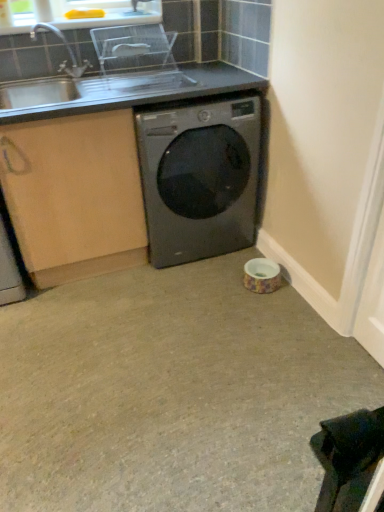
Locate an element on the screen. Image resolution: width=384 pixels, height=512 pixels. satin black washing machine at center is located at coordinates tap(199, 178).

This screenshot has width=384, height=512. Describe the element at coordinates (90, 68) in the screenshot. I see `silver metallic sink at upper left` at that location.

Locate an element on the screen. beige carpet at center is located at coordinates (171, 393).

Is satin black washing machine at center not near beige carpet at center?

That's not correct — satin black washing machine at center is a little close to beige carpet at center.

Is satin black washing machine at center to the left or to the right of beige carpet at center in the image?

From the image, it's evident that satin black washing machine at center is to the right of beige carpet at center.

Which of these two, satin black washing machine at center or beige carpet at center, stands taller?

satin black washing machine at center is taller.

From a real-world perspective, is satin black washing machine at center located higher than beige carpet at center?

Yes, from a real-world perspective, satin black washing machine at center is over beige carpet at center

Is clear plastic dish rack at upper center turned away from silver metallic sink at upper left?

Absolutely, clear plastic dish rack at upper center is directed away from silver metallic sink at upper left.

What's the angular difference between clear plastic dish rack at upper center and silver metallic sink at upper left's facing directions?

clear plastic dish rack at upper center and silver metallic sink at upper left are facing 0.000225 degrees away from each other.

Is point (162, 32) positioned in front of point (8, 94)?

No, it is behind (8, 94).

Does clear plastic dish rack at upper center come in front of silver metallic sink at upper left?

No, clear plastic dish rack at upper center is further to the viewer.

Between point (278, 409) and point (63, 92), which one is positioned behind?

The point (63, 92) is farther from the camera.

Does beige carpet at center have a larger size compared to silver metallic sink at upper left?

No, beige carpet at center is not bigger than silver metallic sink at upper left.

Is beige carpet at center with silver metallic sink at upper left?

No, beige carpet at center is not making contact with silver metallic sink at upper left.

Can you see satin black washing machine at center touching silver metallic sink at upper left?

No, satin black washing machine at center is not touching silver metallic sink at upper left.

You are a GUI agent. You are given a task and a screenshot of the screen. Output one action in this format:
    pyautogui.click(x=<x>, y=<y>)
    Task: Click on the washing machine that appears on the right of silver metallic sink at upper left
    The width and height of the screenshot is (384, 512).
    Given the screenshot: What is the action you would take?
    pyautogui.click(x=199, y=178)

Which is behind, point (175, 108) or point (52, 83)?

The point (52, 83) is farther.

Considering the sizes of satin black washing machine at center and silver metallic sink at upper left in the image, is satin black washing machine at center taller or shorter than silver metallic sink at upper left?

Clearly, satin black washing machine at center is taller compared to silver metallic sink at upper left.

Considering the relative sizes of silver metallic sink at upper left and clear plastic dish rack at upper center in the image provided, is silver metallic sink at upper left shorter than clear plastic dish rack at upper center?

Incorrect, the height of silver metallic sink at upper left does not fall short of that of clear plastic dish rack at upper center.

Do you think silver metallic sink at upper left is within clear plastic dish rack at upper center, or outside of it?

silver metallic sink at upper left is outside clear plastic dish rack at upper center.

From the image's perspective, which one is positioned lower, silver metallic sink at upper left or clear plastic dish rack at upper center?

From the image's view, silver metallic sink at upper left is below.

Is the position of silver metallic sink at upper left less distant than that of clear plastic dish rack at upper center?

Yes, silver metallic sink at upper left is in front of clear plastic dish rack at upper center.

Does silver metallic sink at upper left touch satin black washing machine at center?

No, silver metallic sink at upper left is not next to satin black washing machine at center.

Between point (122, 61) and point (241, 194), which one is positioned behind?

The point (122, 61) is farther from the camera.

How different are the orientations of silver metallic sink at upper left and satin black washing machine at center in degrees?

There is a 0.000334-degree angle between the facing directions of silver metallic sink at upper left and satin black washing machine at center.

Locate an element on the screen. The height and width of the screenshot is (512, 384). washing machine lying behind the silver metallic sink at upper left is located at coordinates pyautogui.click(x=199, y=178).

Is clear plastic dish rack at upper center to the left or to the right of satin black washing machine at center in the image?

clear plastic dish rack at upper center is to the left of satin black washing machine at center.

The height and width of the screenshot is (512, 384). Identify the location of appliance on the left side of satin black washing machine at center. [x=138, y=58].

Looking at this image, how many degrees apart are the facing directions of clear plastic dish rack at upper center and satin black washing machine at center?

The facing directions of clear plastic dish rack at upper center and satin black washing machine at center are 0.000124 degrees apart.

Would you say clear plastic dish rack at upper center is a long distance from satin black washing machine at center?

They are positioned close to each other.

Locate an element on the screen. washing machine behind the beige carpet at center is located at coordinates (199, 178).

Where is `appliance above the silver metallic sink at upper left (from the image's perspective)`? appliance above the silver metallic sink at upper left (from the image's perspective) is located at coordinates coord(138,58).

When comparing their distances from clear plastic dish rack at upper center, does satin black washing machine at center or beige carpet at center seem further?

Among the two, beige carpet at center is located further to clear plastic dish rack at upper center.

From the image, which object appears to be farther from beige carpet at center, clear plastic dish rack at upper center or satin black washing machine at center?

clear plastic dish rack at upper center.

Estimate the real-world distances between objects in this image. Which object is closer to beige carpet at center, clear plastic dish rack at upper center or silver metallic sink at upper left?

The object closer to beige carpet at center is silver metallic sink at upper left.

Estimate the real-world distances between objects in this image. Which object is further from silver metallic sink at upper left, satin black washing machine at center or beige carpet at center?

The object further to silver metallic sink at upper left is beige carpet at center.

When comparing their distances from clear plastic dish rack at upper center, does beige carpet at center or satin black washing machine at center seem further?

The object further to clear plastic dish rack at upper center is beige carpet at center.

When comparing their distances from clear plastic dish rack at upper center, does silver metallic sink at upper left or beige carpet at center seem further?

The object further to clear plastic dish rack at upper center is beige carpet at center.

From the image, which object appears to be nearer to silver metallic sink at upper left, clear plastic dish rack at upper center or beige carpet at center?

clear plastic dish rack at upper center is positioned closer to the anchor silver metallic sink at upper left.

Consider the image. Based on their spatial positions, is beige carpet at center or clear plastic dish rack at upper center closer to silver metallic sink at upper left?

Based on the image, clear plastic dish rack at upper center appears to be nearer to silver metallic sink at upper left.

Find the location of a particular element. Image resolution: width=384 pixels, height=512 pixels. sink between clear plastic dish rack at upper center and beige carpet at center vertically is located at coordinates (90, 68).

Locate an element on the screen. This screenshot has height=512, width=384. sink between clear plastic dish rack at upper center and satin black washing machine at center in the vertical direction is located at coordinates (90, 68).

Identify the location of washing machine between silver metallic sink at upper left and beige carpet at center from top to bottom. (199, 178).

Locate an element on the screen. washing machine that lies between clear plastic dish rack at upper center and beige carpet at center from top to bottom is located at coordinates (199, 178).